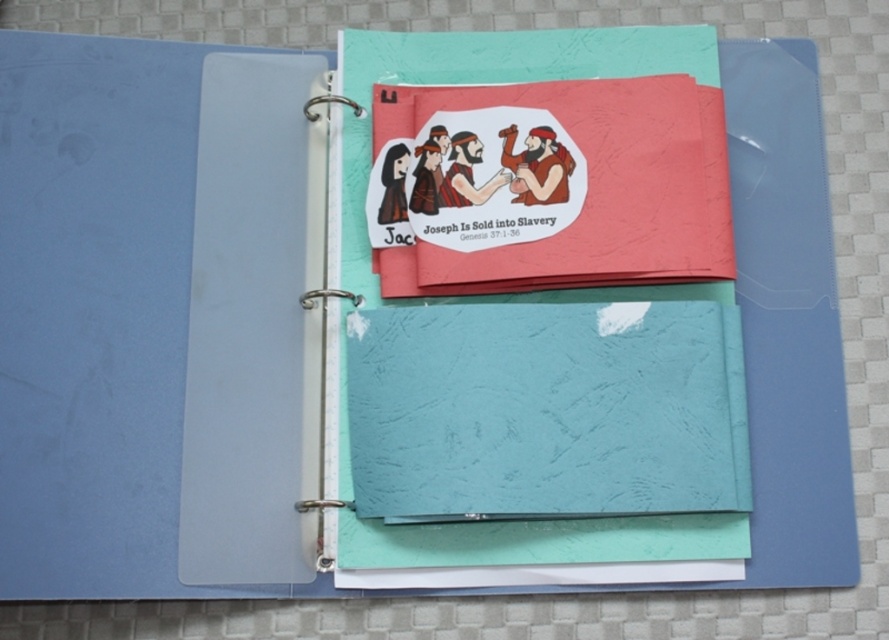
Which is above, teal textured notepad at center or matte paper journal at center?

matte paper journal at center is above.

Based on the photo, measure the distance between teal textured notepad at center and matte paper journal at center.

teal textured notepad at center and matte paper journal at center are 4.01 inches apart.

Locate an element on the screen. teal textured notepad at center is located at coordinates (546, 410).